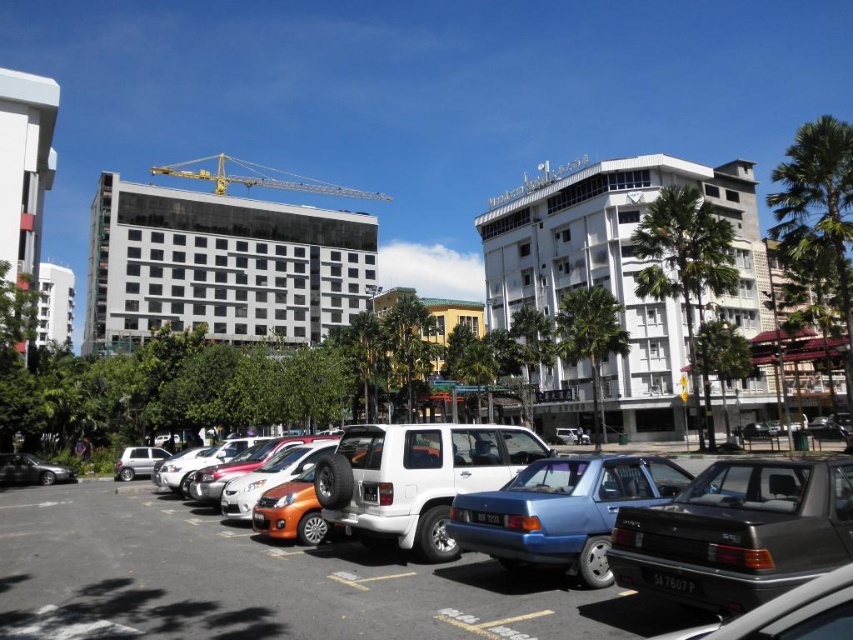
In the scene shown: Can you confirm if white matte suv at center is wider than white glossy building at upper left?

No.

Image resolution: width=853 pixels, height=640 pixels. Identify the location of white matte suv at center. (416, 477).

You are a GUI agent. You are given a task and a screenshot of the screen. Output one action in this format:
    pyautogui.click(x=<x>, y=<y>)
    Task: Click on the white matte suv at center
    
    Given the screenshot: What is the action you would take?
    pyautogui.click(x=416, y=477)

Can you confirm if white concrete building at center is positioned to the right of dark gray metallic sedan at center right?

Yes, white concrete building at center is to the right of dark gray metallic sedan at center right.

Who is shorter, white concrete building at center or dark gray metallic sedan at center right?

With less height is dark gray metallic sedan at center right.

Identify the location of white concrete building at center. (619, 269).

The height and width of the screenshot is (640, 853). I want to click on white concrete building at center, so click(x=619, y=269).

Does point (422, 529) come farther from viewer compared to point (665, 493)?

Yes, point (422, 529) is farther from viewer.

Does point (471, 458) lie in front of point (578, 481)?

That is False.

What are the coordinates of `white matte suv at center` in the screenshot? It's located at (416, 477).